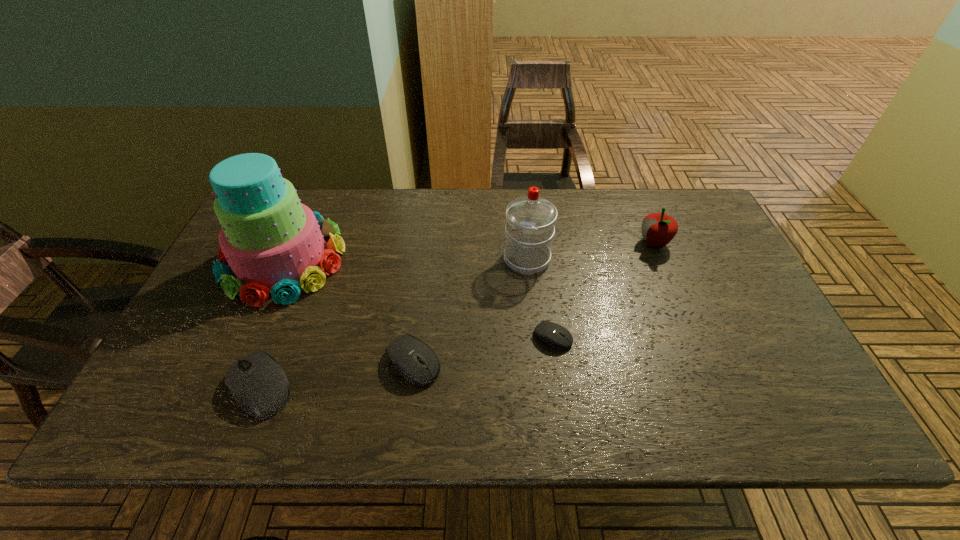
Please point out where to position a new computer equipment on the right to maintain spacing. Please provide its 2D coordinates. Your answer should be formatted as a tuple, i.e. [(x, y)], where the tuple contains the x and y coordinates of a point satisfying the conditions above.

[(680, 315)]